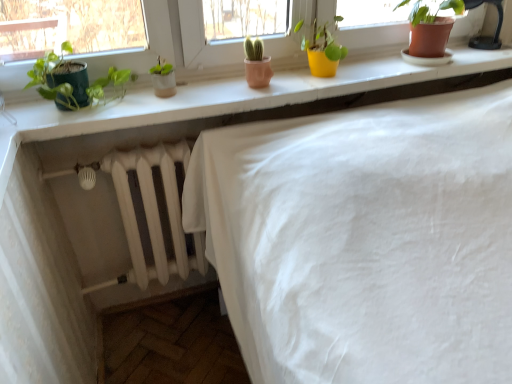
At what (x,y) coordinates should I click in order to perform the action: click on vacant space to the right of green matte pot at left, acting as the 3th houseplant starting from the right. Please return your answer as a coordinate pair (x, y). This screenshot has width=512, height=384. Looking at the image, I should click on (164, 99).